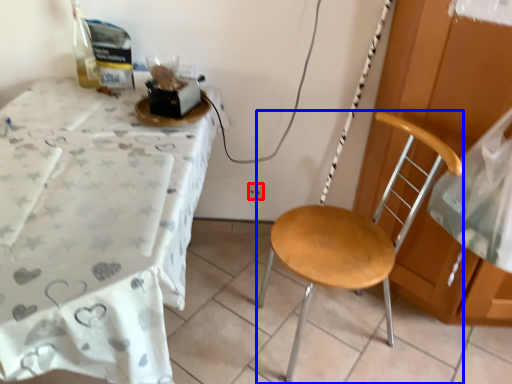
Question: Among these objects, which one is farthest to the camera, power outlet (highlighted by a red box) or chair (highlighted by a blue box)?

Choices:
 (A) power outlet
 (B) chair

Answer: (A)